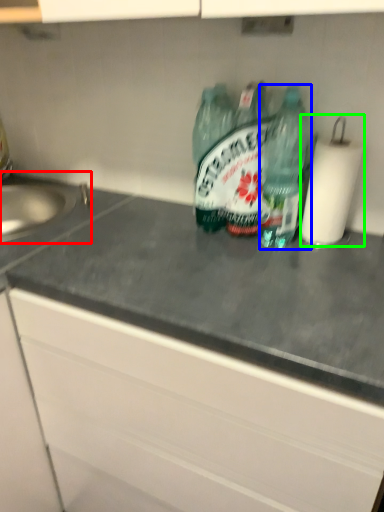
Question: Estimate the real-world distances between objects in this image. Which object is farther from sink (highlighted by a red box), bottle (highlighted by a blue box) or paper towel (highlighted by a green box)?

Choices:
 (A) bottle
 (B) paper towel

Answer: (B)